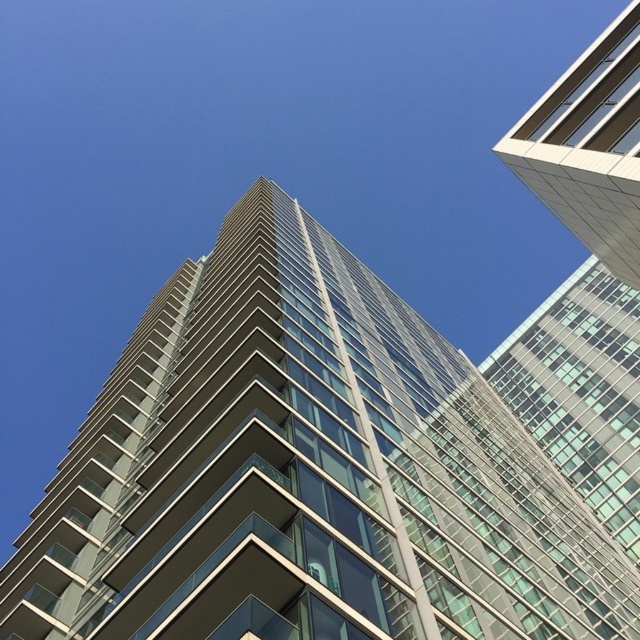
Question: Is glassy steel building at center positioned in front of white glass building at upper right?

Choices:
 (A) yes
 (B) no

Answer: (A)

Question: Does glassy steel building at center have a smaller size compared to white glass building at upper right?

Choices:
 (A) yes
 (B) no

Answer: (B)

Question: Which of the following is the farthest from the observer?

Choices:
 (A) white glass building at upper right
 (B) glassy steel building at center

Answer: (A)

Question: Does glassy steel building at center appear on the left side of white glass building at upper right?

Choices:
 (A) no
 (B) yes

Answer: (B)